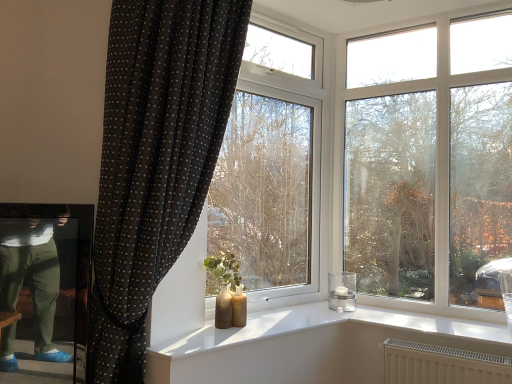
Where is `free spot to the left of clear glass candle holder at window`? This screenshot has width=512, height=384. free spot to the left of clear glass candle holder at window is located at coordinates (313, 312).